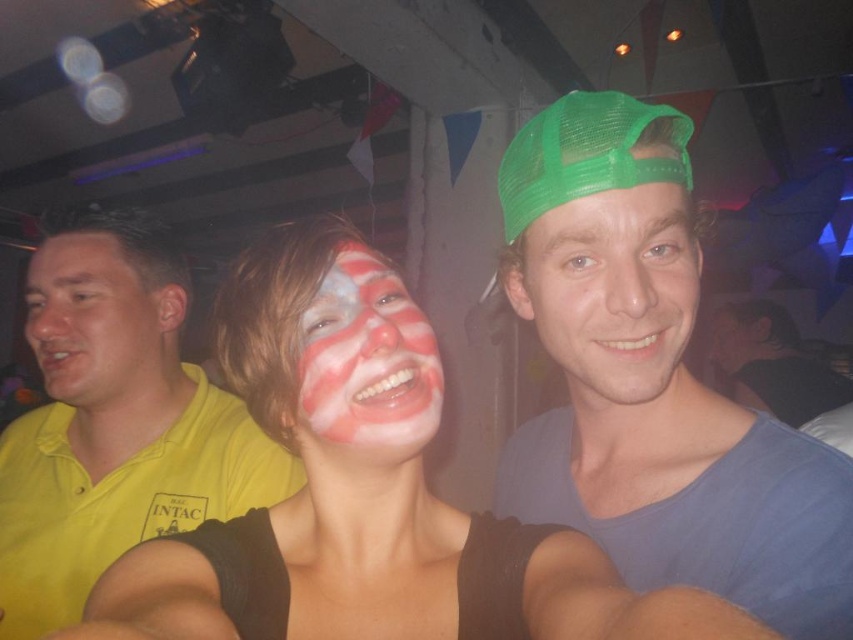
You are a photographer at the party and want to capture a clear photo of the green mesh cap at center and the matte blue shirt at center. Which object should you focus on first to ensure both are in focus?

The green mesh cap at center is above the matte blue shirt at center, so you should focus on the green mesh cap at center first to ensure both are in focus.

Consider the image. What is located at the coordinates point (x=612, y=291) in the image?

The green mesh cap at center is located at point (x=612, y=291).